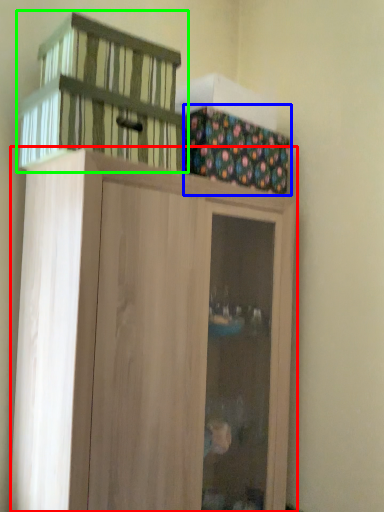
Question: Which is nearer to the cupboard (highlighted by a red box)? cabinetry (highlighted by a blue box) or basket (highlighted by a green box).

Choices:
 (A) cabinetry
 (B) basket

Answer: (B)